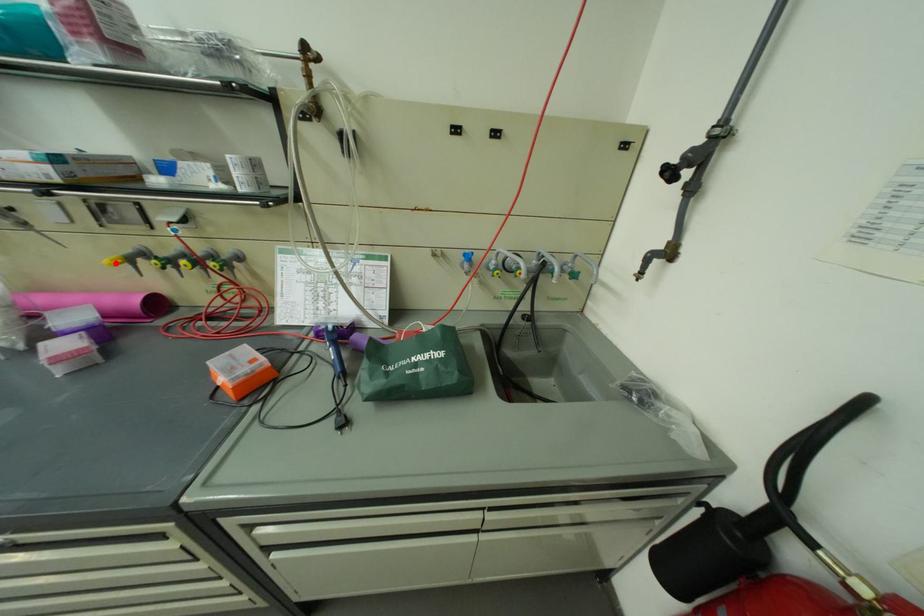
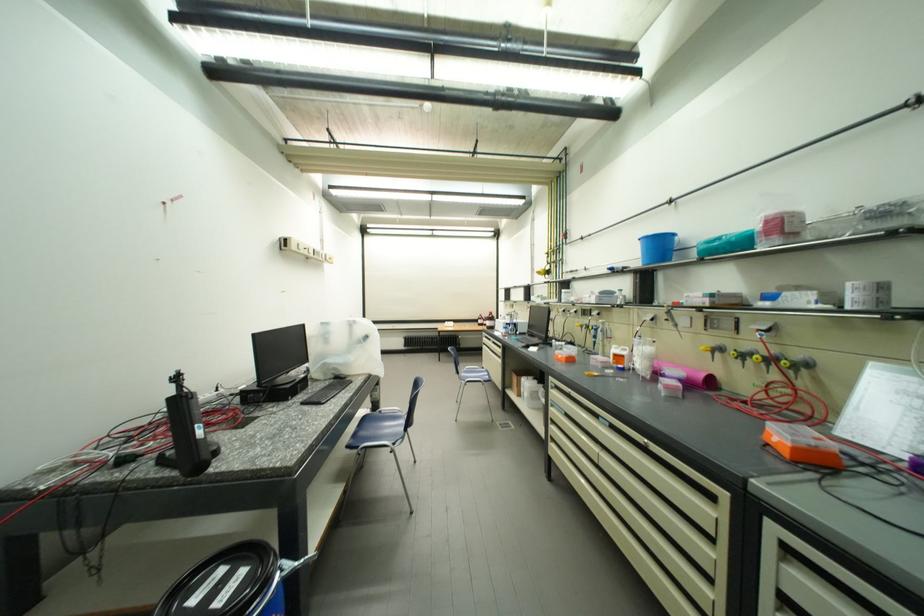
Locate, in the second image, the point that corresponds to the highlighted location in the first image.

(712, 350)